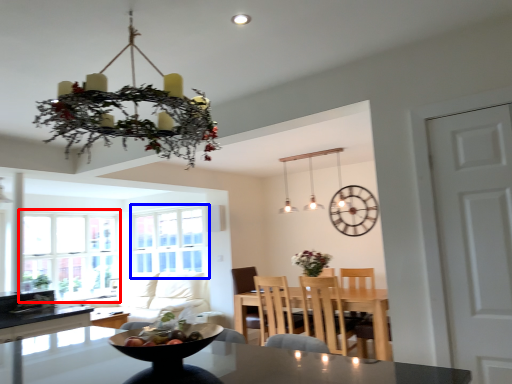
Question: Which object appears closest to the camera in this image, window (highlighted by a red box) or window screen (highlighted by a blue box)?

Choices:
 (A) window
 (B) window screen

Answer: (A)